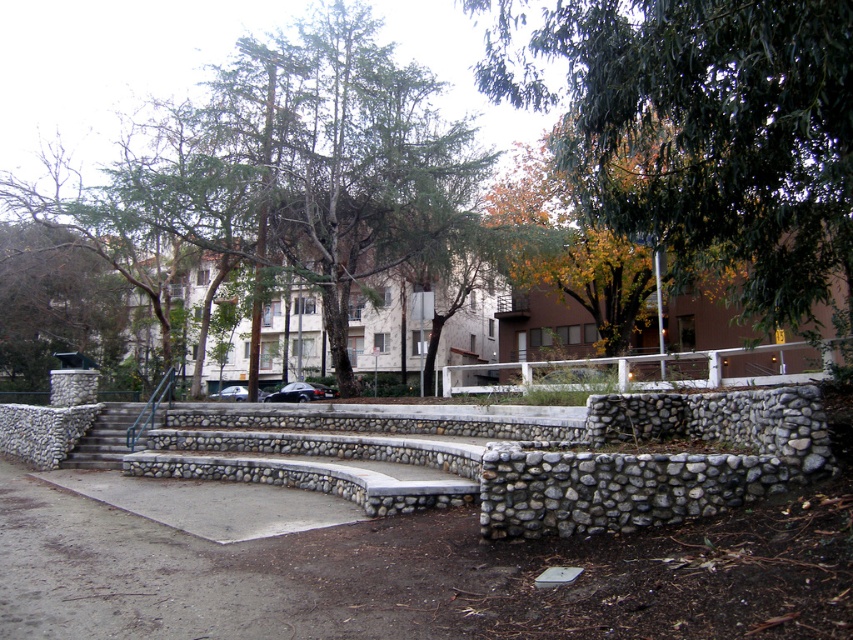
Does green leafy tree at upper center have a greater width compared to gray concrete stairs at center?

Yes.

Is green leafy tree at upper center smaller than gray concrete stairs at center?

No, green leafy tree at upper center is not smaller than gray concrete stairs at center.

Which is behind, point (531, 83) or point (122, 436)?

The point (122, 436) is behind.

Find the location of a particular element. The image size is (853, 640). green leafy tree at upper center is located at coordinates (703, 132).

Does green leafy tree at upper center have a lesser height compared to white wooden rail at center?

No, green leafy tree at upper center is not shorter than white wooden rail at center.

Is green leafy tree at upper center closer to the viewer compared to white wooden rail at center?

Yes, it is.

Between point (674, 4) and point (631, 360), which one is positioned in front?

Positioned in front is point (674, 4).

I want to click on green leafy tree at upper center, so click(x=703, y=132).

Is white wooden rail at center thinner than gray concrete stairs at center?

Incorrect, white wooden rail at center's width is not less than gray concrete stairs at center's.

Does white wooden rail at center lie in front of gray concrete stairs at center?

Yes, it is.

Find the location of a particular element. white wooden rail at center is located at coordinates (650, 369).